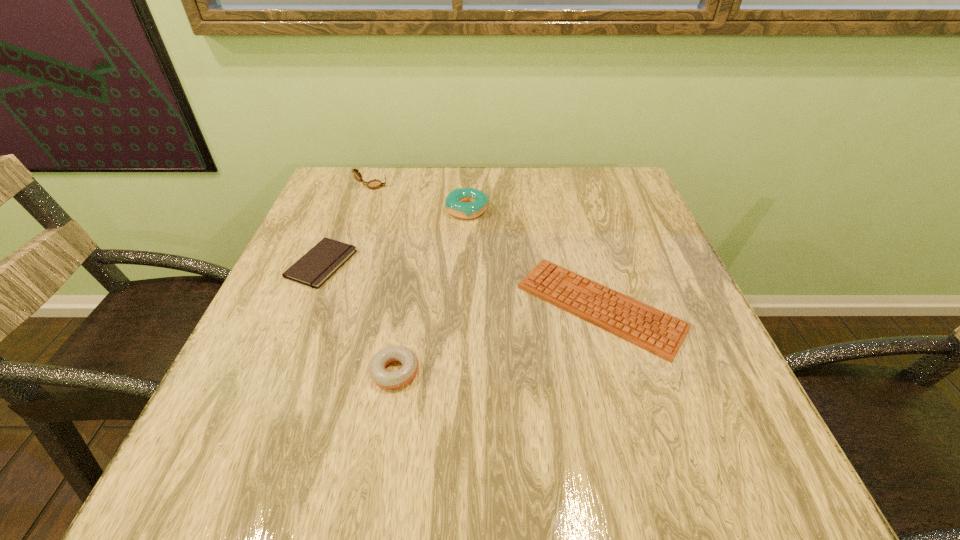
Find the location of a particular element. This screenshot has width=960, height=540. free space located 0.080m on the back of the left doughnut is located at coordinates (404, 319).

Where is `free space located 0.260m on the back of the computer keyboard`? This screenshot has height=540, width=960. free space located 0.260m on the back of the computer keyboard is located at coordinates (569, 199).

The image size is (960, 540). Find the location of `free space located 0.180m on the back of the checkbook`. free space located 0.180m on the back of the checkbook is located at coordinates pyautogui.click(x=348, y=200).

This screenshot has height=540, width=960. Identify the location of compass that is at the far edge. (375, 184).

This screenshot has width=960, height=540. Find the location of `doughnut that is at the far edge`. doughnut that is at the far edge is located at coordinates (466, 203).

At what (x,y) coordinates should I click in order to perform the action: click on compass at the left edge. Please return your answer as a coordinate pair (x, y). Looking at the image, I should click on (375, 184).

In order to click on checkbook positioned at the left edge in this screenshot , I will do [x=313, y=269].

This screenshot has height=540, width=960. In order to click on object that is at the right edge in this screenshot , I will do `click(662, 334)`.

Locate an element on the screen. This screenshot has width=960, height=540. object located at the far left corner is located at coordinates (375, 184).

Find the location of a particular element. This screenshot has height=540, width=960. vacant space at the far edge of the desktop is located at coordinates (404, 172).